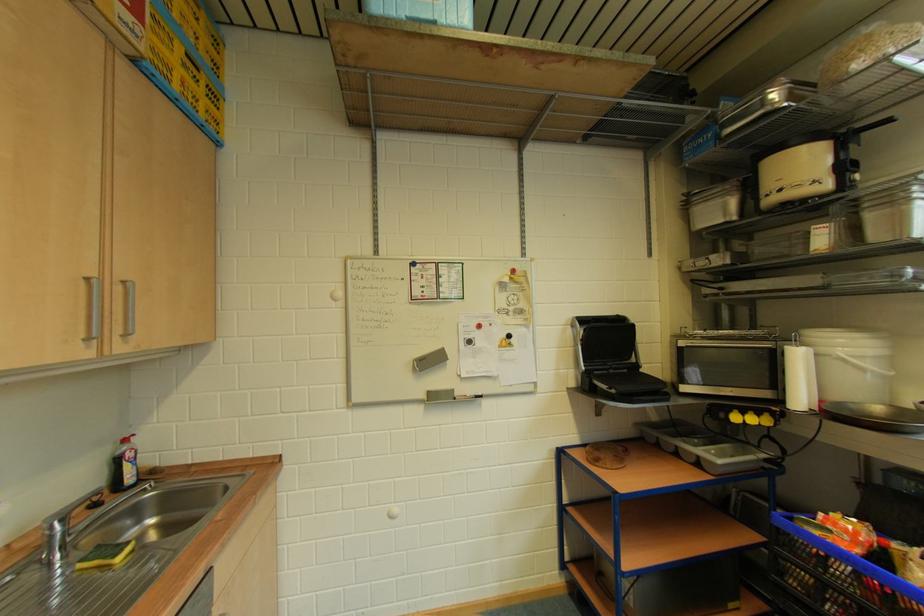
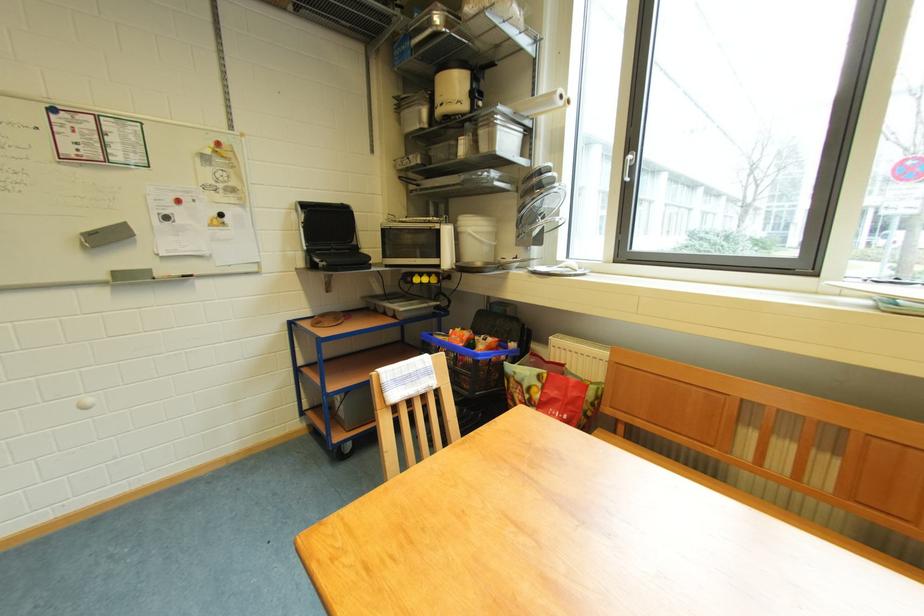
Find the pixel in the second image that matches (x=759, y=422) in the first image.

(432, 283)